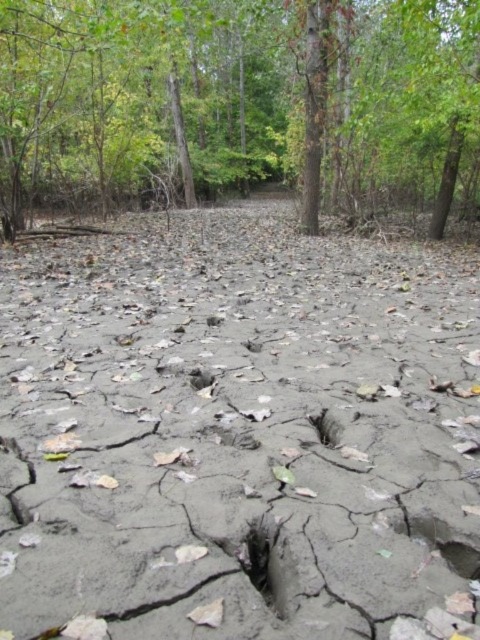
Question: Does gray cracked mud at center have a lesser width compared to black matte hole at center?

Choices:
 (A) yes
 (B) no

Answer: (B)

Question: Does brown wood tree at center have a lesser width compared to dark gray mud hole at lower right?

Choices:
 (A) yes
 (B) no

Answer: (B)

Question: Which object appears closest to the camera in this image?

Choices:
 (A) brown wood tree at center
 (B) smooth gray hole at center
 (C) black matte hole at center

Answer: (C)

Question: Is gray cracked mud at center bigger than dark gray mud hole at lower right?

Choices:
 (A) no
 (B) yes

Answer: (B)

Question: Which point is closer to the camera taking this photo?

Choices:
 (A) (135, 582)
 (B) (442, 552)
 (C) (283, 529)

Answer: (A)

Question: Among these objects, which one is nearest to the camera?

Choices:
 (A) smooth gray hole at center
 (B) brown wood tree at center

Answer: (A)